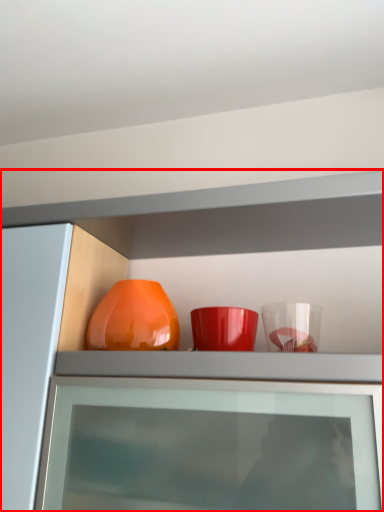
Question: Observing the image, what is the correct spatial positioning of cabinetry (annotated by the red box) in reference to vase?

Choices:
 (A) left
 (B) right

Answer: (B)